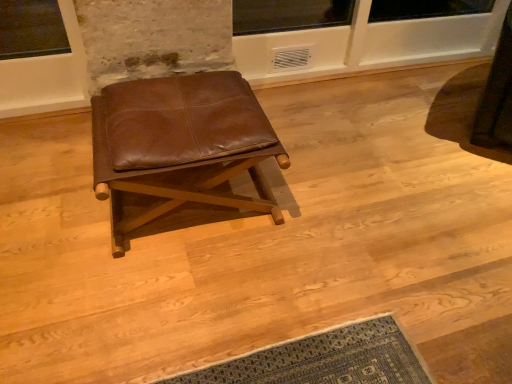
Find the location of a particular element. The image size is (512, 384). vacant space to the right of brown leather stool at center is located at coordinates (331, 207).